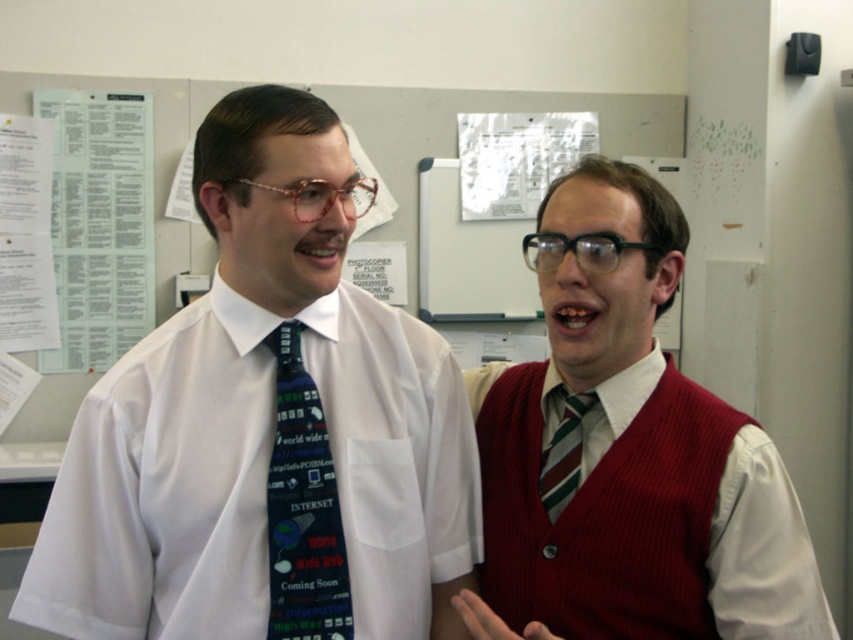
You are an office worker who needs to locate the blue fabric tie at center and the white paper at upper left. According to the scene, which object is positioned more to the left?

Result: The white paper at upper left is positioned more to the left than the blue fabric tie at center.

You are organizing a costume party and need to decide which item to place on a shelf that can only hold items up to 1.2 meters tall. You have the knitted red vest at center and the striped fabric tie at center. Based on their sizes, which item can safely be placed on the shelf?

The knitted red vest at center is taller than the striped fabric tie at center. Since the shelf can hold items up to 1.2 meters tall, the knitted red vest at center can be placed on the shelf as long as its height is within the limit. However, without specific measurements, we can only confirm that the striped fabric tie at center is shorter and thus definitely safe for the shelf.

From the picture: You are standing in the office and want to point to the exact location of the point at coordinates (x=604, y=515). Which object in the scene does this point correspond to?

The point at coordinates (x=604, y=515) is located on the knitted red vest at center.